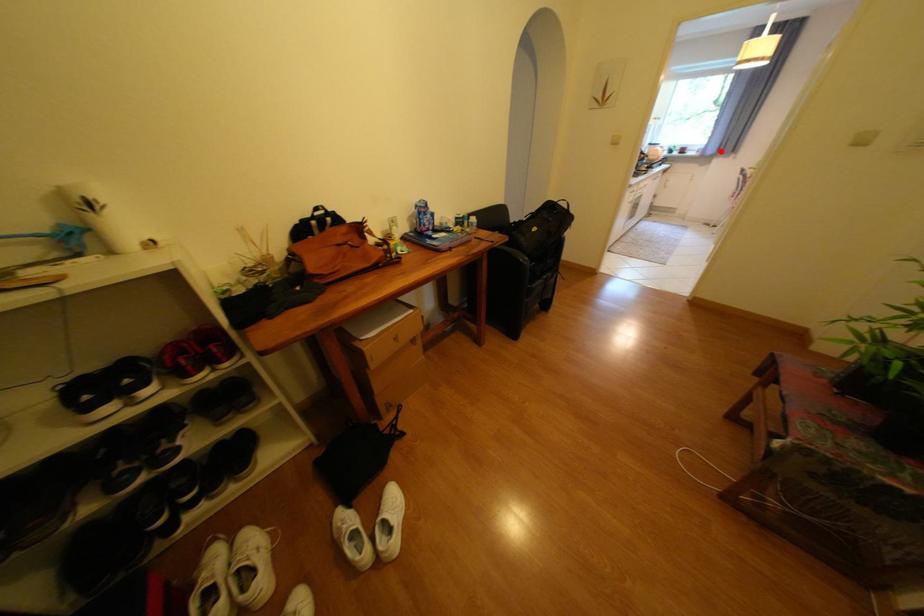
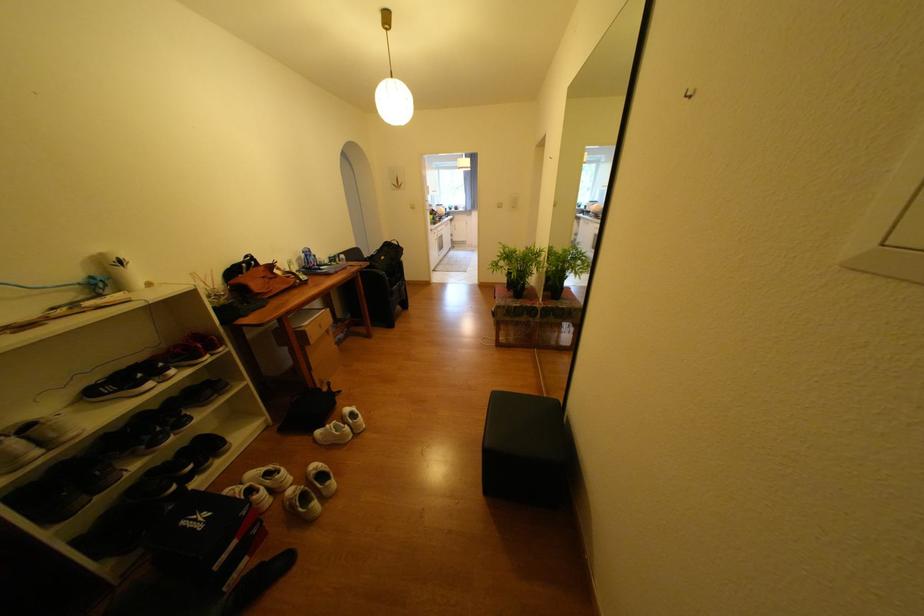
Where in the second image is the point corresponding to the highlighted location from the first image?

(479, 208)